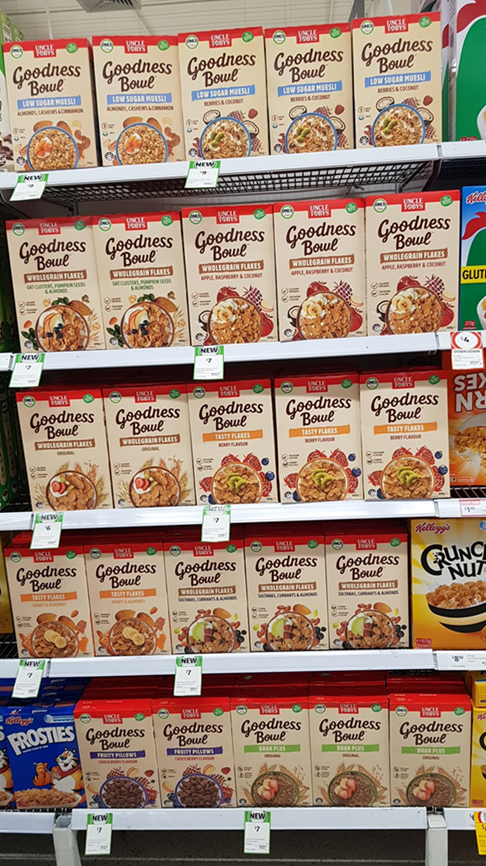
The image size is (486, 866). What are the coordinates of `shelf support bracket` in the screenshot? It's located at (439, 171), (429, 172), (3, 204), (19, 205).